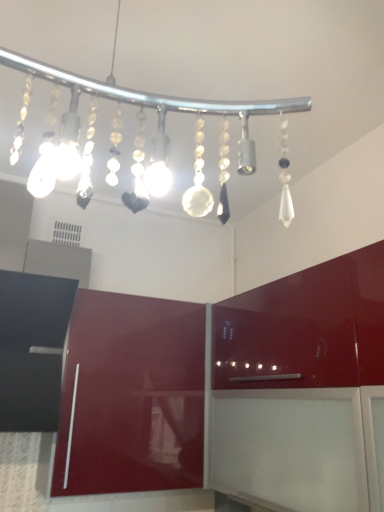
Question: In the image, is clear glass chandelier at upper center positioned in front of or behind glossy burgundy cabinet at lower left, which is counted as the 2th cabinetry, starting from the right?

Choices:
 (A) front
 (B) behind

Answer: (A)

Question: Do you think clear glass chandelier at upper center is within glossy burgundy cabinet at lower left, the 1th cabinetry in the left-to-right sequence, or outside of it?

Choices:
 (A) outside
 (B) inside

Answer: (A)

Question: Which object is positioned closest to the glossy burgundy cabinet at lower left, which is counted as the 2th cabinetry, starting from the right?

Choices:
 (A) glossy red cabinet at center, the first cabinetry positioned from the right
 (B) clear glass chandelier at upper center

Answer: (A)

Question: Which object is the closest to the clear glass chandelier at upper center?

Choices:
 (A) glossy burgundy cabinet at lower left, the 1th cabinetry in the left-to-right sequence
 (B) glossy red cabinet at center, which is counted as the 2th cabinetry, starting from the left

Answer: (B)